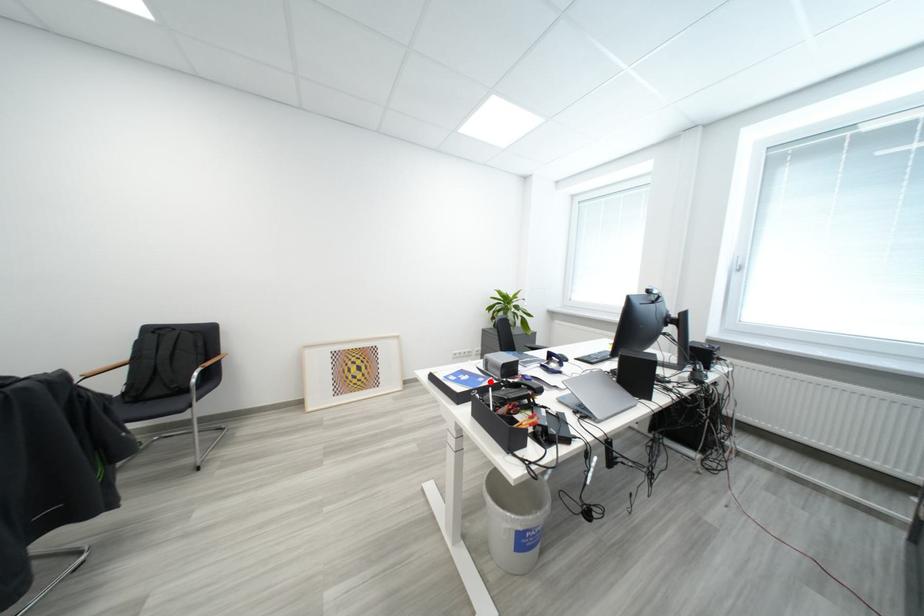
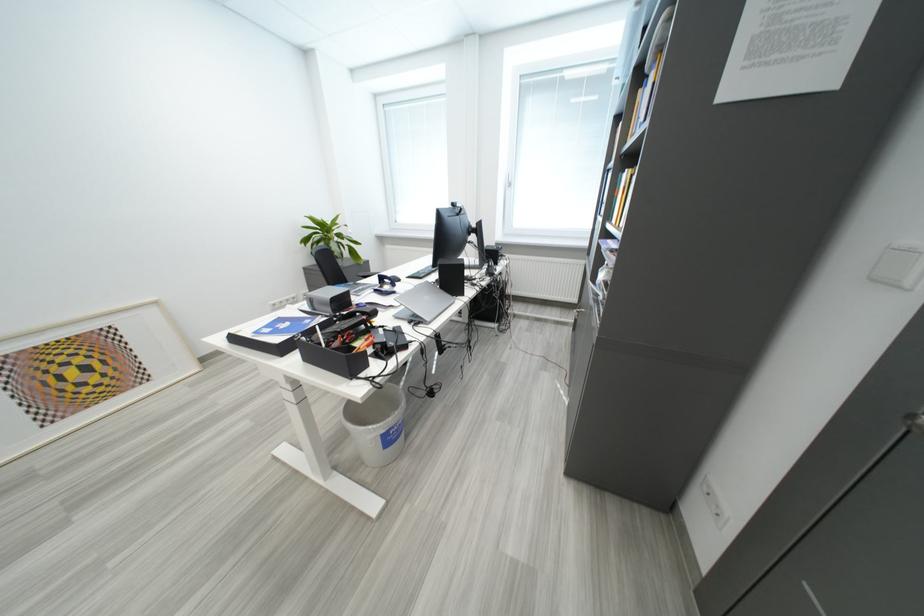
In the second image, find the point that corresponds to the highlighted location in the first image.

(317, 323)